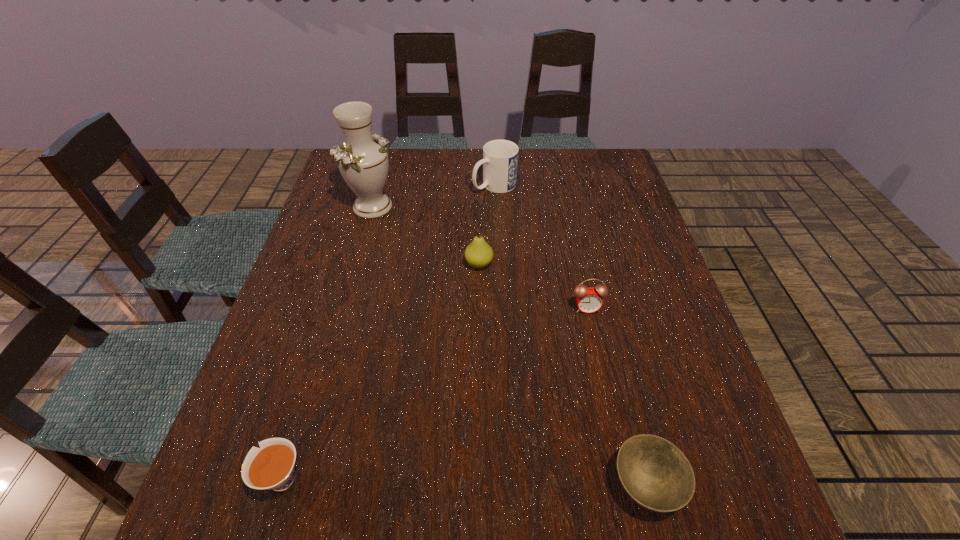
At what (x,y) coordinates should I click in order to perform the action: click on free space that is in between the mug and the alarm clock. Please return your answer as a coordinate pair (x, y). Looking at the image, I should click on (540, 247).

At what (x,y) coordinates should I click in order to perform the action: click on vacant space that's between the teacup and the third farthest object. Please return your answer as a coordinate pair (x, y). This screenshot has width=960, height=540. Looking at the image, I should click on (379, 372).

Identify the location of free space between the teacup and the fourth tallest object. (433, 394).

Locate an element on the screen. The height and width of the screenshot is (540, 960). free point between the vase and the bowl is located at coordinates (509, 346).

Select which object appears as the third closest to the teacup. Please provide its 2D coordinates. Your answer should be formatted as a tuple, i.e. [(x, y)], where the tuple contains the x and y coordinates of a point satisfying the conditions above.

[(589, 299)]

Identify which object is located as the third nearest to the bowl. Please provide its 2D coordinates. Your answer should be formatted as a tuple, i.e. [(x, y)], where the tuple contains the x and y coordinates of a point satisfying the conditions above.

[(271, 467)]

The image size is (960, 540). I want to click on vacant space that satisfies the following two spatial constraints: 1. on the front side of the vase; 2. on the side of the teacup with the handle, so click(x=297, y=479).

This screenshot has height=540, width=960. Find the location of `free space that satisfies the following two spatial constraints: 1. on the clock face of the fourth farthest object; 2. on the side of the teacup with the handle`. free space that satisfies the following two spatial constraints: 1. on the clock face of the fourth farthest object; 2. on the side of the teacup with the handle is located at coordinates (624, 479).